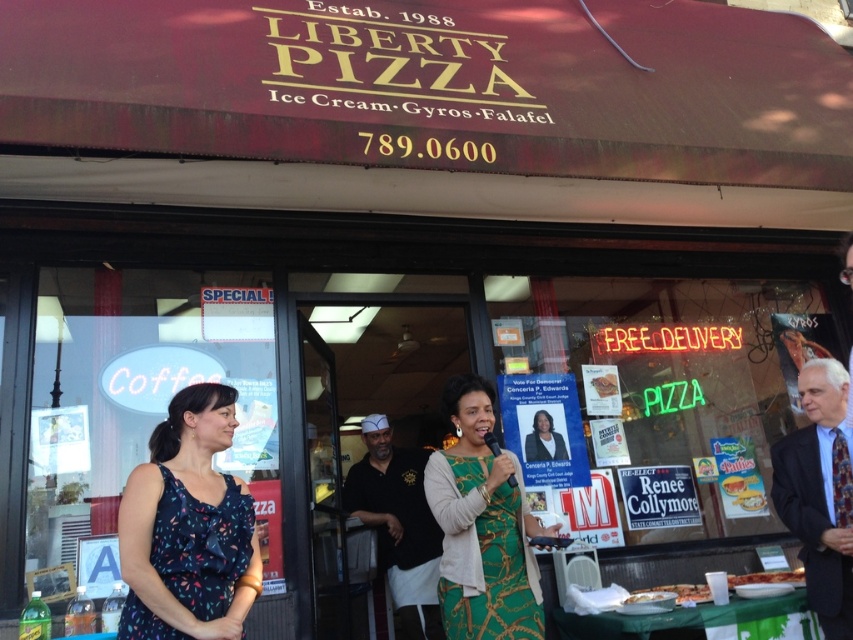
You are a customer waiting outside Liberty Pizza and notice two items in the window display. You see the green textured dress at center and the golden crispy pizza slice at lower right. Which item takes up more space in the window display?

The green textured dress at center is larger in size than the golden crispy pizza slice at lower right, so the green textured dress at center takes up more space in the window display.